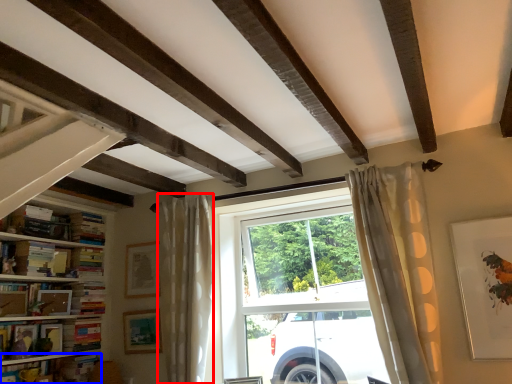
Question: Which point is further to the camera, curtain (highlighted by a red box) or book (highlighted by a blue box)?

Choices:
 (A) curtain
 (B) book

Answer: (B)